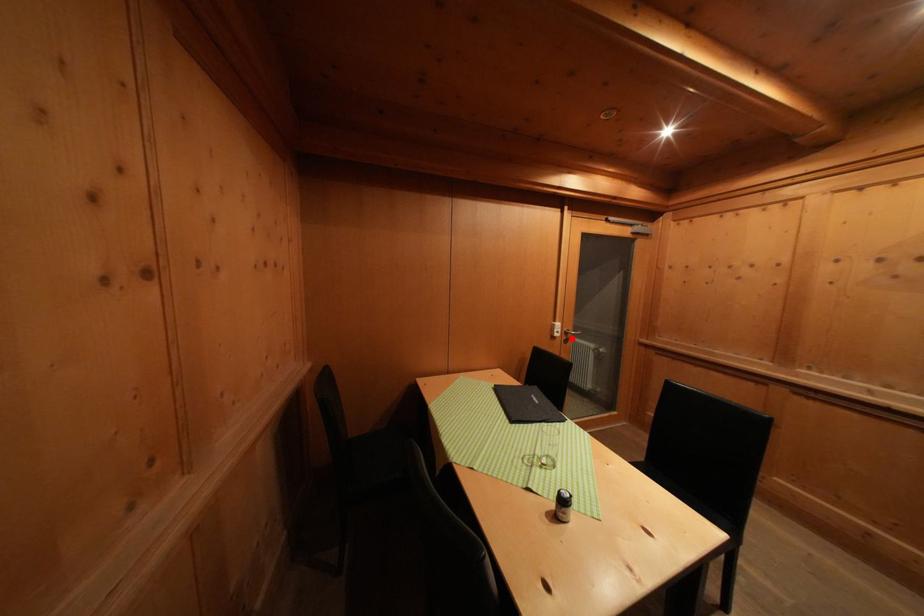
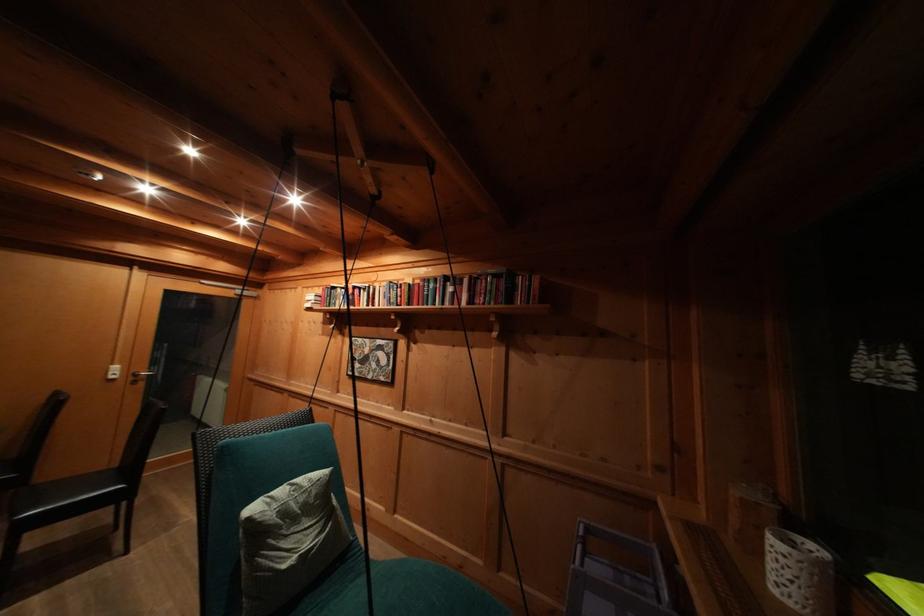
Find the pixel in the second image that matches the highlighted location in the first image.

(141, 379)